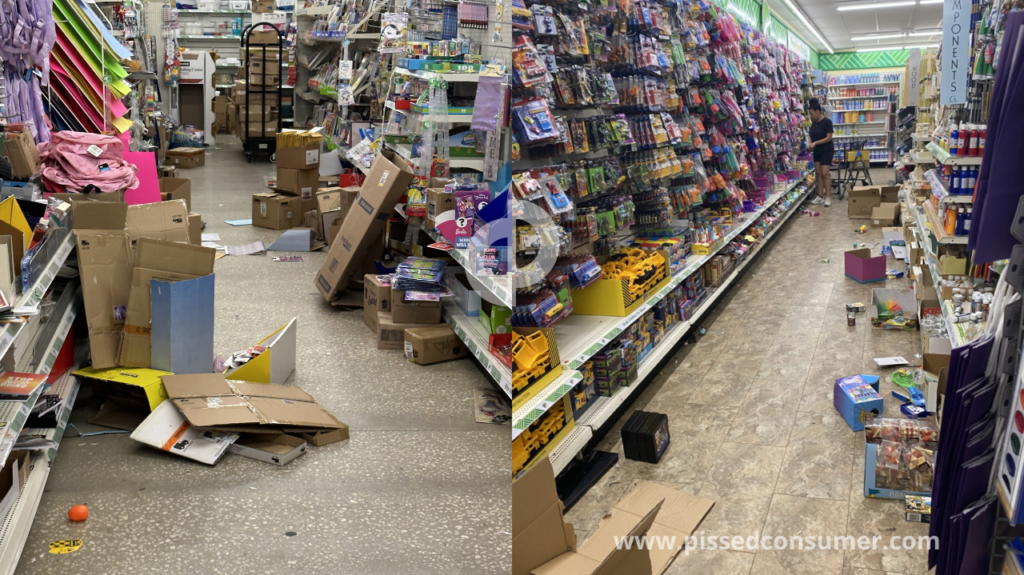
Identify the location of pile of pink plush fabric. (51, 177), (80, 160), (80, 140).